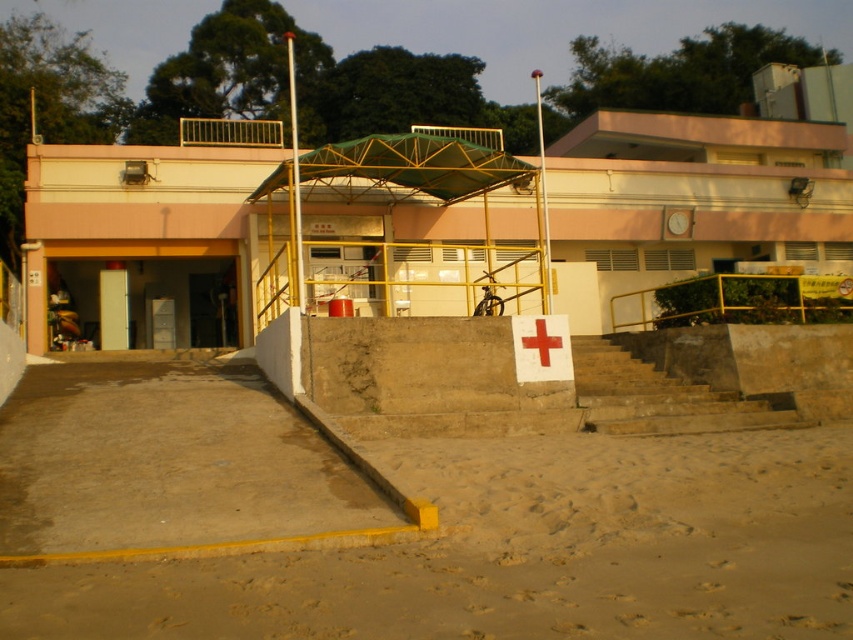
Which is in front, point (757, 611) or point (701, 388)?

Positioned in front is point (757, 611).

Is sandy at lower center thinner than brown stone stairs at center?

Yes, sandy at lower center is thinner than brown stone stairs at center.

Which is in front, point (769, 481) or point (675, 396)?

Point (769, 481)

Identify the location of sandy at lower center. This screenshot has height=640, width=853. (521, 554).

Does sandy at lower center have a lesser width compared to white paper cross at center?

No, sandy at lower center is not thinner than white paper cross at center.

Does sandy at lower center appear under white paper cross at center?

Yes.

Where is `sandy at lower center`? sandy at lower center is located at coordinates (521, 554).

Is brown stone stairs at center positioned in front of white paper cross at center?

Yes, it is.

This screenshot has width=853, height=640. I want to click on brown stone stairs at center, so click(659, 396).